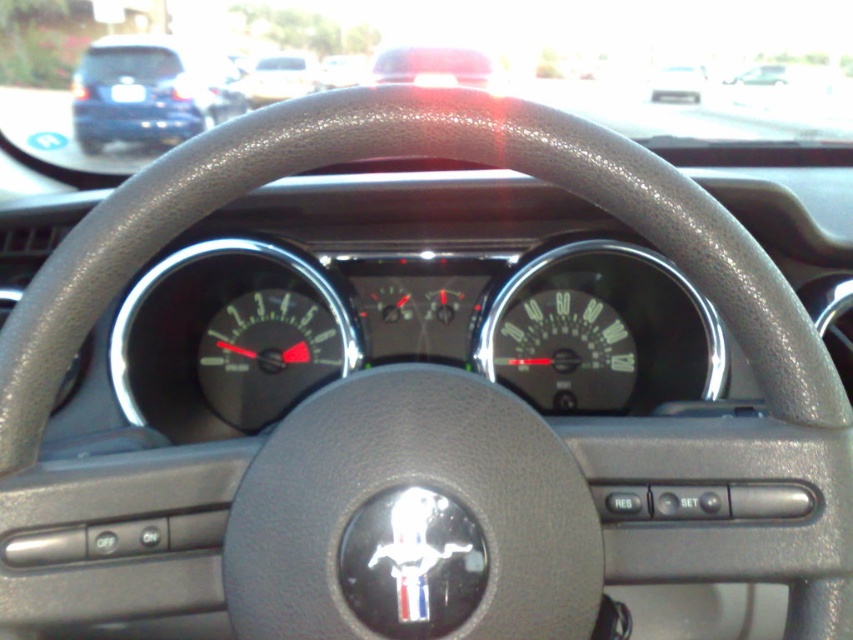
You are a driver checking your car instruments. You see the black matte speedometer at center and the white matte car at upper center. Which object is positioned higher on the dashboard?

The white matte car at upper center is positioned higher on the dashboard than the black matte speedometer at center.

You are a car mechanic inspecting the dashboard of a car. You notice a point at coordinates (140, 92). What object is located at this point?

The object located at point (140, 92) is the matte black car at upper left.

You are a mechanic working on a car. You need to access the black matte speedometer at center for maintenance. The tools you have are 1.2 meters long. Can you reach the speedometer without extending your arm beyond the tool length?

The distance between the black matte speedometer at center and the camera is 1.32 meters. Since the tools are 1.2 meters long, you cannot reach the speedometer without extending your arm beyond the tool length.